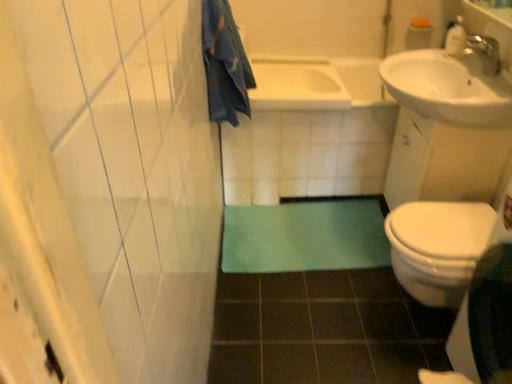
Question: Do you think blue cotton towel at upper left is within green rubber bath mat at lower center, or outside of it?

Choices:
 (A) outside
 (B) inside

Answer: (A)

Question: Considering their positions, is blue cotton towel at upper left located in front of or behind green rubber bath mat at lower center?

Choices:
 (A) front
 (B) behind

Answer: (A)

Question: Which object is positioned farthest from the green rubber bath mat at lower center?

Choices:
 (A) white glossy bathtub at center, which is counted as the 1th bath, starting from the left
 (B) white plastic soap dispenser at upper right
 (C) blue cotton towel at upper left
 (D) silver metallic faucet at upper right
 (E) white glossy bathtub at center, which is counted as the 1th bath, starting from the right

Answer: (B)

Question: Which object is the closest to the white plastic soap dispenser at upper right?

Choices:
 (A) white glossy sink at upper right
 (B) silver metallic faucet at upper right
 (C) green rubber bath mat at lower center
 (D) white glossy bathtub at center, placed as the 2th bath when sorted from left to right
 (E) blue cotton towel at upper left

Answer: (B)